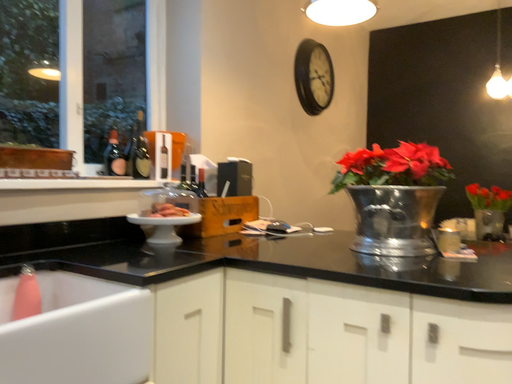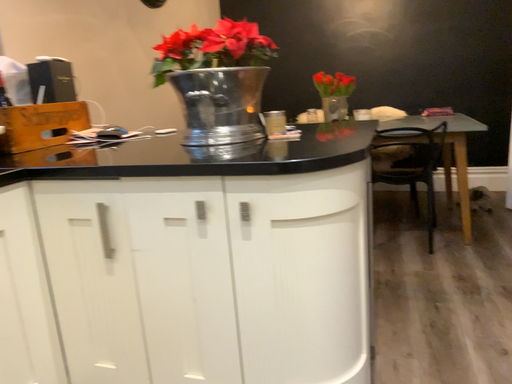
Question: How did the camera likely rotate when shooting the video?

Choices:
 (A) rotated upward
 (B) rotated downward

Answer: (B)